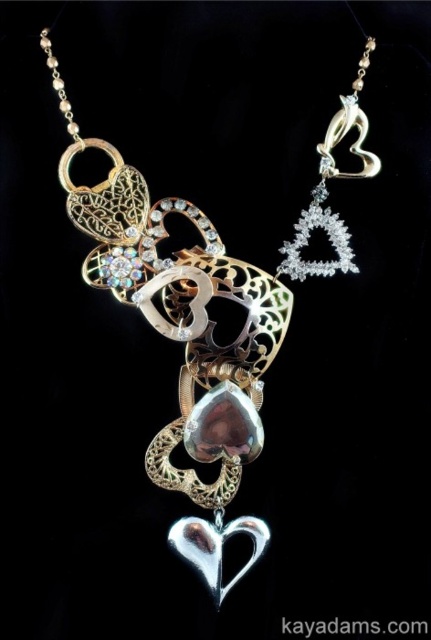
Is point (280, 305) more distant than point (337, 140)?

Yes.

Is silver metallic heart at center closer to camera compared to clear crystal triangle at upper center?

Yes, silver metallic heart at center is in front of clear crystal triangle at upper center.

This screenshot has height=640, width=431. Describe the element at coordinates (206, 316) in the screenshot. I see `silver metallic heart at center` at that location.

Where is `silver metallic heart at center`? The width and height of the screenshot is (431, 640). silver metallic heart at center is located at coordinates (206, 316).

Is clear crystal triangle at upper center further to the viewer compared to shiny silver heart at center?

No, clear crystal triangle at upper center is in front of shiny silver heart at center.

Is point (340, 260) positioned before point (205, 552)?

No, (340, 260) is further to viewer.

Locate an element on the screen. clear crystal triangle at upper center is located at coordinates 327,188.

From the picture: Can you confirm if silver metallic heart at center is wider than shiny silver heart at center?

Correct, the width of silver metallic heart at center exceeds that of shiny silver heart at center.

Which of these two, silver metallic heart at center or shiny silver heart at center, stands shorter?

shiny silver heart at center is shorter.

From the picture: Measure the distance between silver metallic heart at center and camera.

A distance of 4.24 feet exists between silver metallic heart at center and camera.

This screenshot has width=431, height=640. I want to click on silver metallic heart at center, so click(206, 316).